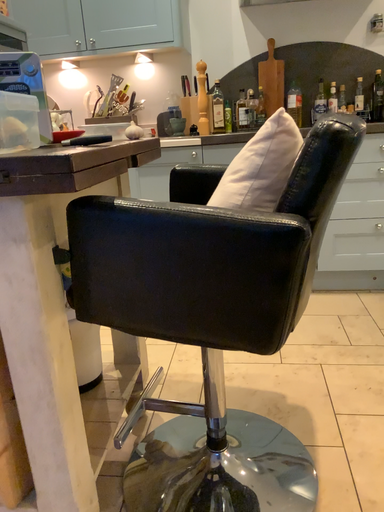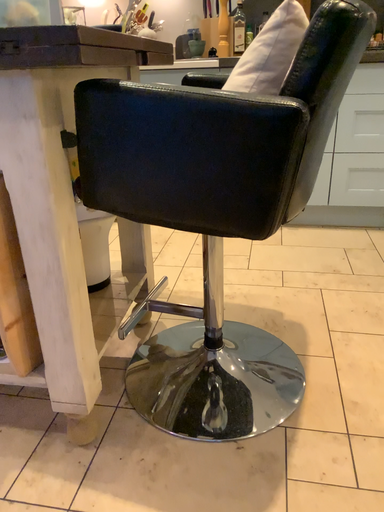
Question: How did the camera likely rotate when shooting the video?

Choices:
 (A) rotated upward
 (B) rotated downward

Answer: (B)